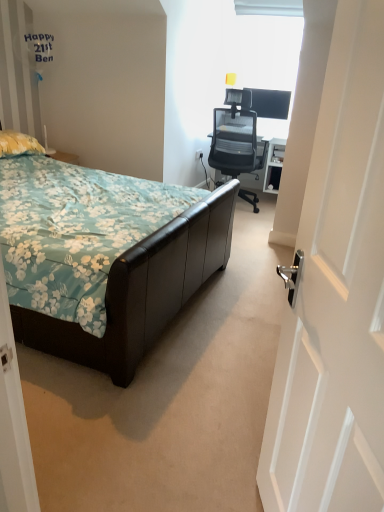
Question: From the image's perspective, is yellow fabric pillow at left positioned above or below black mesh office chair at upper right?

Choices:
 (A) above
 (B) below

Answer: (B)

Question: Is yellow fabric pillow at left spatially inside black mesh office chair at upper right, or outside of it?

Choices:
 (A) outside
 (B) inside

Answer: (A)

Question: Which object is positioned closest to the black mesh office chair at upper right?

Choices:
 (A) transparent glass window at upper center
 (B) white plastic power outlet at center
 (C) leather bed at left
 (D) matte black monitor at upper right
 (E) yellow fabric pillow at left

Answer: (D)

Question: Which object is positioned closest to the yellow fabric pillow at left?

Choices:
 (A) leather bed at left
 (B) matte black monitor at upper right
 (C) black mesh office chair at upper right
 (D) white glossy door at right
 (E) white plastic power outlet at center

Answer: (A)